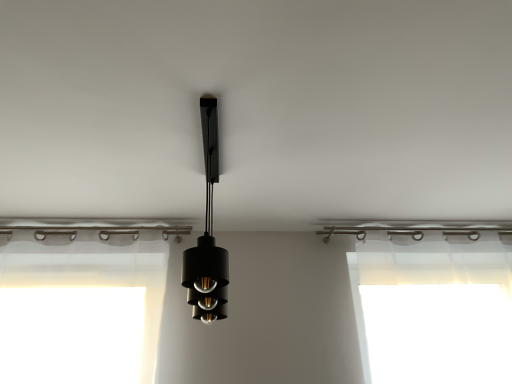
In order to face transparent plastic at right, should I rotate leftwards or rightwards?

You should look right and rotate roughly 23.527 degrees.

The width and height of the screenshot is (512, 384). I want to click on transparent plastic at right, so click(x=432, y=314).

Describe the element at coordinates (432, 314) in the screenshot. This screenshot has height=384, width=512. I see `transparent plastic at right` at that location.

Image resolution: width=512 pixels, height=384 pixels. I want to click on black matte pendant light at center, so click(x=207, y=234).

What do you see at coordinates (207, 234) in the screenshot?
I see `black matte pendant light at center` at bounding box center [207, 234].

What are the coordinates of `transparent plastic at right` in the screenshot? It's located at (432, 314).

Is black matte pendant light at center at the left side of transparent plastic at right?

Correct, you'll find black matte pendant light at center to the left of transparent plastic at right.

Is black matte pendant light at center closer to the viewer compared to transparent plastic at right?

Yes, the depth of black matte pendant light at center is less than that of transparent plastic at right.

Is point (206, 266) less distant than point (411, 354)?

Yes.

From the image's perspective, does black matte pendant light at center appear lower than transparent plastic at right?

Incorrect, from the image's perspective, black matte pendant light at center is higher than transparent plastic at right.

From a real-world perspective, who is located lower, black matte pendant light at center or transparent plastic at right?

transparent plastic at right.

Which of these two, black matte pendant light at center or transparent plastic at right, is wider?

black matte pendant light at center is wider.

Can you confirm if black matte pendant light at center is taller than transparent plastic at right?

No.

Considering the relative sizes of black matte pendant light at center and transparent plastic at right in the image provided, is black matte pendant light at center bigger than transparent plastic at right?

Actually, black matte pendant light at center might be smaller than transparent plastic at right.

Is black matte pendant light at center completely or partially outside of transparent plastic at right?

Yes, black matte pendant light at center is located beyond the bounds of transparent plastic at right.

Is black matte pendant light at center directly adjacent to transparent plastic at right?

No, black matte pendant light at center is not in contact with transparent plastic at right.

Is black matte pendant light at center turned away from transparent plastic at right?

No, black matte pendant light at center is not facing the opposite direction of transparent plastic at right.

In order to click on lamp above the transparent plastic at right (from a real-world perspective) in this screenshot , I will do `click(207, 234)`.

Between transparent plastic at right and black matte pendant light at center, which one appears on the left side from the viewer's perspective?

black matte pendant light at center.

Relative to black matte pendant light at center, is transparent plastic at right in front or behind?

transparent plastic at right is positioned farther from the viewer than black matte pendant light at center.

Is point (480, 280) positioned before point (212, 148)?

No.

Consider the image. From the image's perspective, is transparent plastic at right above or below black matte pendant light at center?

From the image's perspective, transparent plastic at right appears below black matte pendant light at center.

From a real-world perspective, which object stands above the other?

black matte pendant light at center.

Is transparent plastic at right thinner than black matte pendant light at center?

Indeed, transparent plastic at right has a lesser width compared to black matte pendant light at center.

Is transparent plastic at right taller than black matte pendant light at center?

Yes, transparent plastic at right is taller than black matte pendant light at center.

Based on their sizes in the image, would you say transparent plastic at right is bigger or smaller than black matte pendant light at center?

Considering their sizes, transparent plastic at right takes up more space than black matte pendant light at center.

Is transparent plastic at right positioned beyond the bounds of black matte pendant light at center?

transparent plastic at right is positioned outside black matte pendant light at center.

Is transparent plastic at right with black matte pendant light at center?

No, transparent plastic at right is not beside black matte pendant light at center.

Is transparent plastic at right aimed at black matte pendant light at center?

No, transparent plastic at right is not oriented towards black matte pendant light at center.

You are a GUI agent. You are given a task and a screenshot of the screen. Output one action in this format:
    pyautogui.click(x=<x>, y=<y>)
    Task: Click on the lamp above the transparent plastic at right (from the image's perspective)
    The width and height of the screenshot is (512, 384).
    Given the screenshot: What is the action you would take?
    pyautogui.click(x=207, y=234)

Where is `lamp on the left of transparent plastic at right`? lamp on the left of transparent plastic at right is located at coordinates (207, 234).

Identify the location of window screen below the black matte pendant light at center (from the image's perspective). (432, 314).